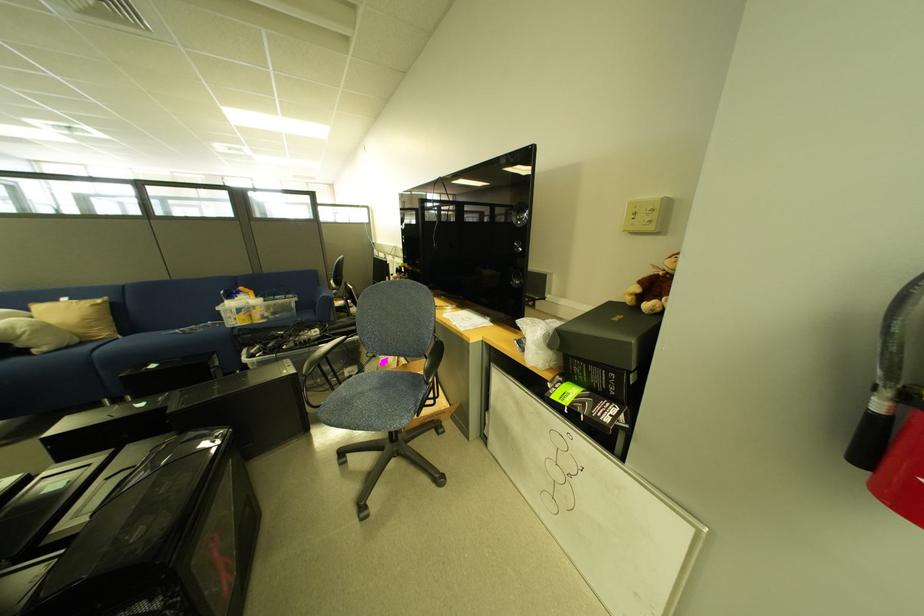
Find where to sit the blue chair seat. Please return your answer as a coordinate pair (x, y).

(373, 400)